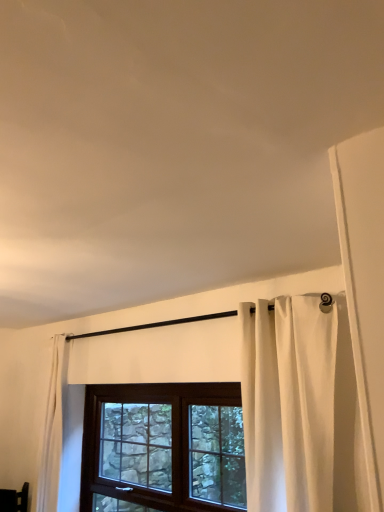
Question: From the image's perspective, relative to white fabric curtain at center, is brown wooden window at center above or below?

Choices:
 (A) above
 (B) below

Answer: (B)

Question: Considering the positions of brown wooden window at center and white fabric curtain at center in the image, is brown wooden window at center taller or shorter than white fabric curtain at center?

Choices:
 (A) tall
 (B) short

Answer: (B)

Question: Do you think brown wooden window at center is within white fabric curtain at center, or outside of it?

Choices:
 (A) inside
 (B) outside

Answer: (B)

Question: Considering the positions of white fabric curtain at center and brown wooden window at center in the image, is white fabric curtain at center wider or thinner than brown wooden window at center?

Choices:
 (A) thin
 (B) wide

Answer: (B)

Question: From a real-world perspective, is white fabric curtain at center physically located above or below brown wooden window at center?

Choices:
 (A) below
 (B) above

Answer: (B)

Question: Choose the correct answer: Is white fabric curtain at center inside brown wooden window at center or outside it?

Choices:
 (A) inside
 (B) outside

Answer: (B)

Question: In terms of height, does white fabric curtain at center look taller or shorter compared to brown wooden window at center?

Choices:
 (A) tall
 (B) short

Answer: (A)